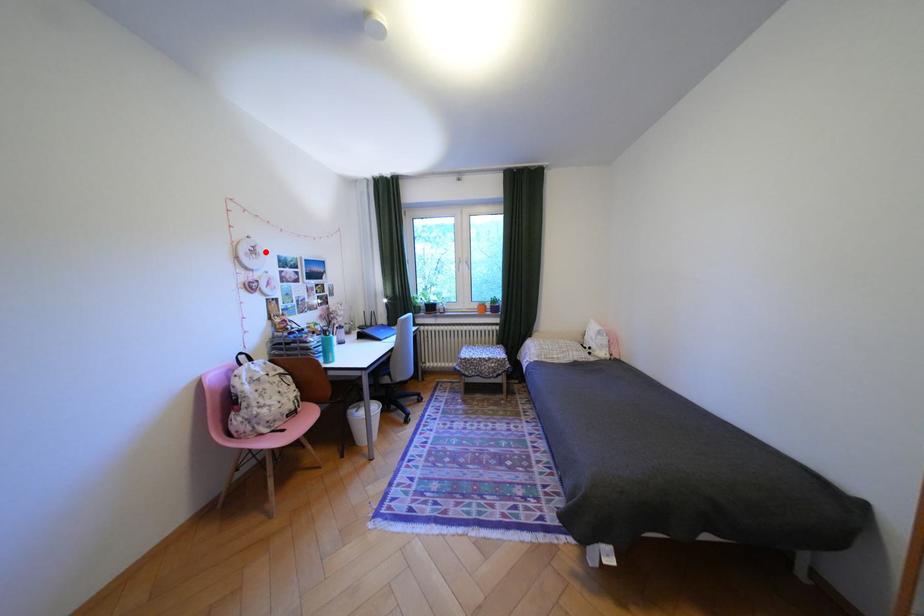
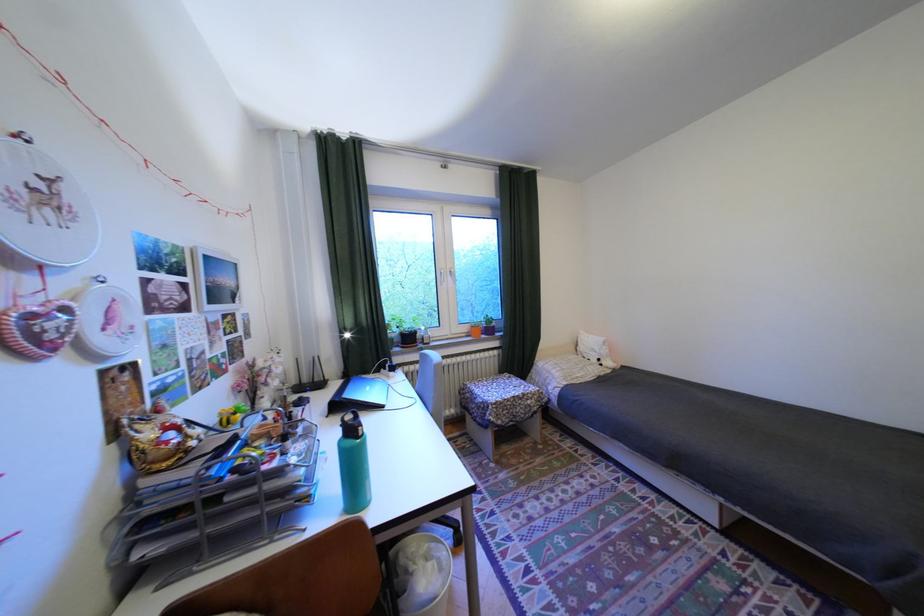
Find the pixel in the second image that matches the highlighted location in the first image.

(58, 197)